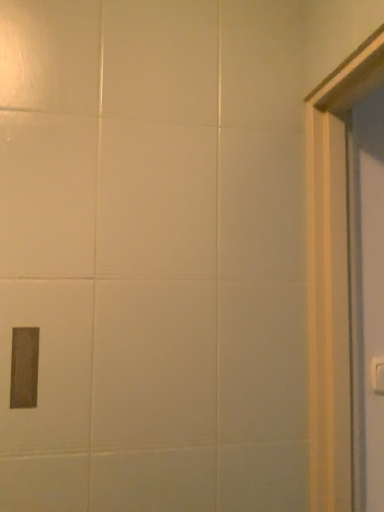
What do you see at coordinates (377, 374) in the screenshot? I see `white plastic electric outlet at right` at bounding box center [377, 374].

Identify the location of white plastic electric outlet at right. (377, 374).

The image size is (384, 512). Find the location of `white plastic electric outlet at right`. white plastic electric outlet at right is located at coordinates (377, 374).